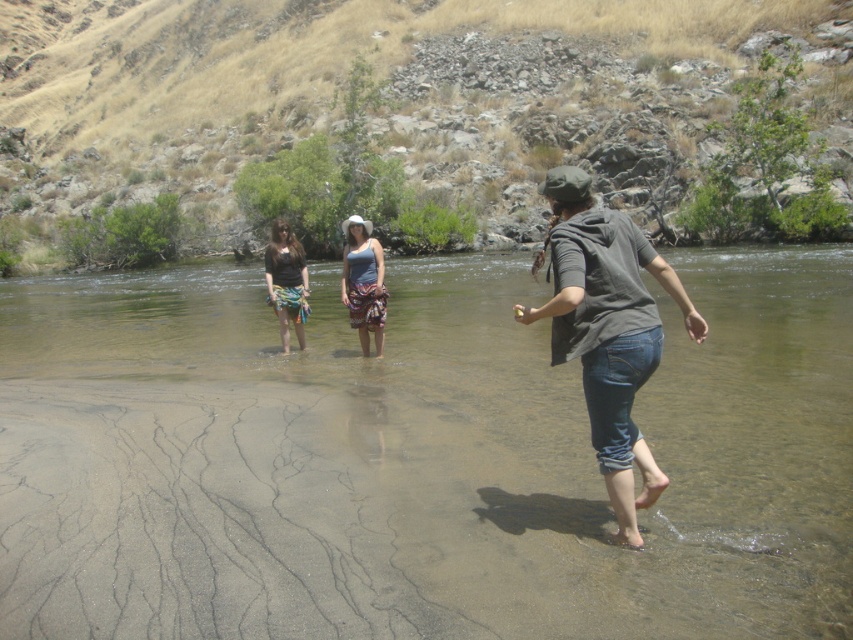
Question: Can you confirm if denim jeans at center is bigger than blue cotton tank top at center?

Choices:
 (A) no
 (B) yes

Answer: (A)

Question: Which of the following is the farthest from the observer?

Choices:
 (A) blue cotton tank top at center
 (B) matte black shirt at center
 (C) denim jeans at center

Answer: (B)

Question: Which of the following is the farthest from the observer?

Choices:
 (A) (283, 221)
 (B) (837, 420)
 (C) (376, 282)
 (D) (596, 417)

Answer: (A)

Question: Does clear sand river at center have a lesser width compared to denim jeans at center?

Choices:
 (A) no
 (B) yes

Answer: (A)

Question: Among these points, which one is farthest from the camera?

Choices:
 (A) (379, 312)
 (B) (286, 260)
 (C) (561, 209)

Answer: (B)

Question: Is denim jeans at center to the left of matte black shirt at center from the viewer's perspective?

Choices:
 (A) yes
 (B) no

Answer: (B)